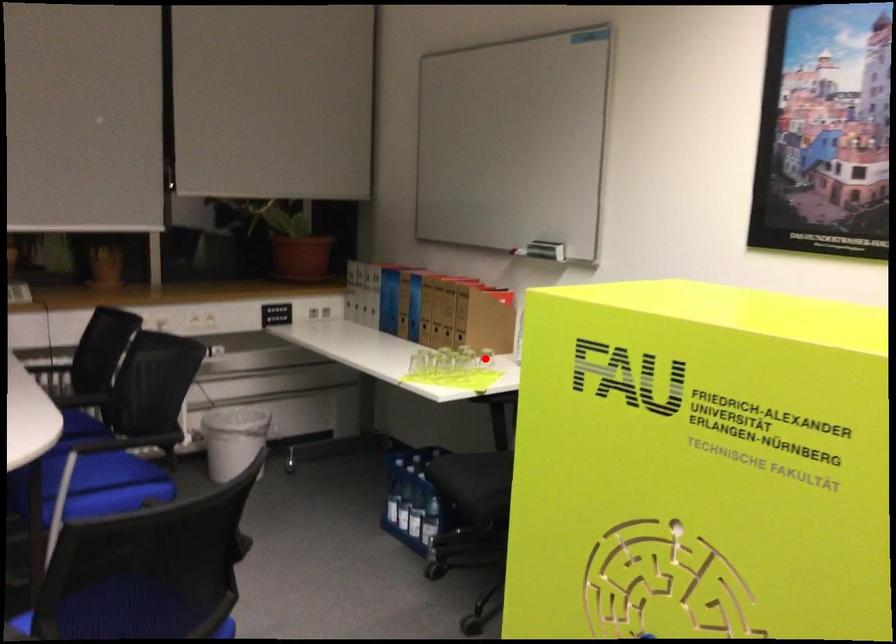
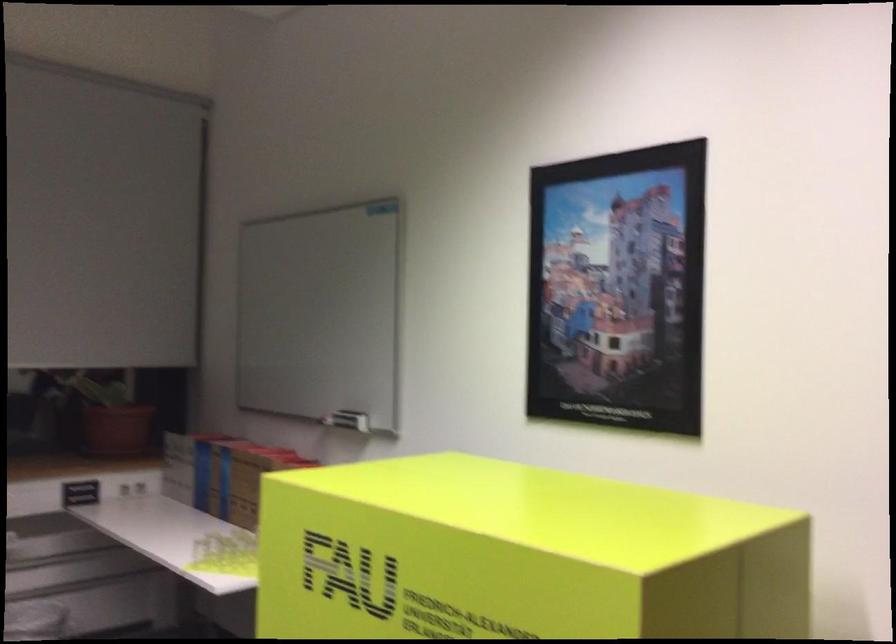
Question: I am providing you with two images of the same scene from different viewpoints. A red point is marked on the first image. Can you still see the location of the red point in image 2?

Choices:
 (A) Yes
 (B) No

Answer: (B)